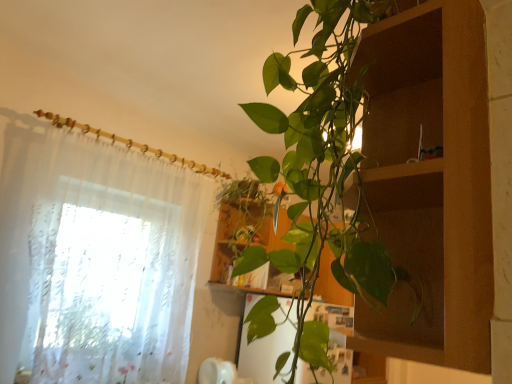
Question: From a real-world perspective, does sheer white curtain at left stand above wooden cabinet at center?

Choices:
 (A) yes
 (B) no

Answer: (B)

Question: Considering the relative sizes of sheer white curtain at left and wooden cabinet at center in the image provided, is sheer white curtain at left wider than wooden cabinet at center?

Choices:
 (A) no
 (B) yes

Answer: (A)

Question: Considering the relative sizes of sheer white curtain at left and wooden cabinet at center in the image provided, is sheer white curtain at left smaller than wooden cabinet at center?

Choices:
 (A) yes
 (B) no

Answer: (B)

Question: Is sheer white curtain at left not close to wooden cabinet at center?

Choices:
 (A) no
 (B) yes

Answer: (A)

Question: Does sheer white curtain at left have a lesser width compared to wooden cabinet at center?

Choices:
 (A) yes
 (B) no

Answer: (A)

Question: Considering the relative positions of sheer white curtain at left and wooden cabinet at center in the image provided, is sheer white curtain at left to the right of wooden cabinet at center from the viewer's perspective?

Choices:
 (A) yes
 (B) no

Answer: (B)

Question: Can you confirm if wooden cabinet at center is thinner than sheer white curtain at left?

Choices:
 (A) no
 (B) yes

Answer: (A)

Question: Considering the relative sizes of wooden cabinet at center and sheer white curtain at left in the image provided, is wooden cabinet at center taller than sheer white curtain at left?

Choices:
 (A) no
 (B) yes

Answer: (A)

Question: Is the depth of wooden cabinet at center less than that of sheer white curtain at left?

Choices:
 (A) yes
 (B) no

Answer: (B)

Question: Can we say wooden cabinet at center lies outside sheer white curtain at left?

Choices:
 (A) yes
 (B) no

Answer: (A)

Question: Can you confirm if wooden cabinet at center is wider than sheer white curtain at left?

Choices:
 (A) yes
 (B) no

Answer: (A)

Question: Can you confirm if wooden cabinet at center is positioned to the right of sheer white curtain at left?

Choices:
 (A) yes
 (B) no

Answer: (A)

Question: From the image's perspective, is sheer white curtain at left above or below wooden cabinet at center?

Choices:
 (A) below
 (B) above

Answer: (B)